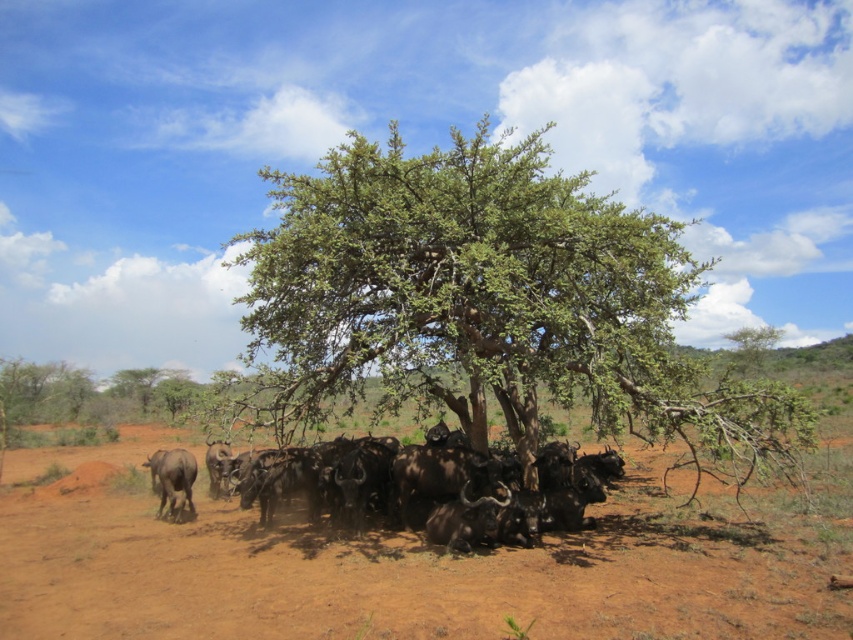
The image size is (853, 640). I want to click on brown dirt field at center, so click(x=407, y=576).

Does brown dirt field at center have a greater height compared to black glossy buffalo at lower center?

Yes.

Who is more distant from viewer, (238,602) or (460,486)?

The point (460,486) is behind.

Locate an element on the screen. The width and height of the screenshot is (853, 640). brown dirt field at center is located at coordinates (407, 576).

Which of these two, green leafy tree at center or black glossy buffalo at lower center, stands shorter?

black glossy buffalo at lower center

Does point (627, 360) come in front of point (581, 490)?

That is True.

Does point (590, 220) come behind point (494, 513)?

Yes, it is behind point (494, 513).

You are a GUI agent. You are given a task and a screenshot of the screen. Output one action in this format:
    pyautogui.click(x=<x>, y=<y>)
    Task: Click on the green leafy tree at center
    The height and width of the screenshot is (640, 853).
    Given the screenshot: What is the action you would take?
    pyautogui.click(x=488, y=300)

Can you confirm if green leafy tree at center is positioned to the left of brown rough yak at lower left?

No, green leafy tree at center is not to the left of brown rough yak at lower left.

Who is more forward, (619, 220) or (173, 515)?

Point (619, 220) is more forward.

Between point (694, 465) and point (184, 468), which one is positioned behind?

Point (694, 465)

Locate an element on the screen. Image resolution: width=853 pixels, height=640 pixels. green leafy tree at center is located at coordinates (488, 300).